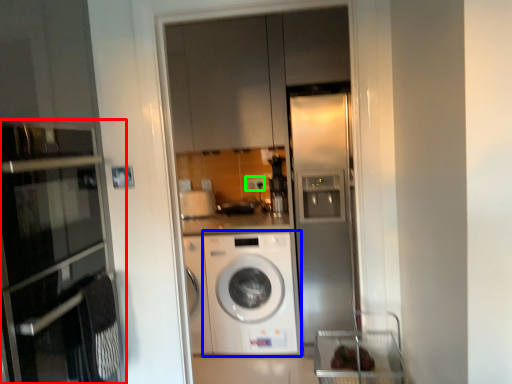
Question: Which object is the closest to the oven (highlighted by a red box)? Choose among these: washing machine (highlighted by a blue box) or electric outlet (highlighted by a green box).

Choices:
 (A) washing machine
 (B) electric outlet

Answer: (A)